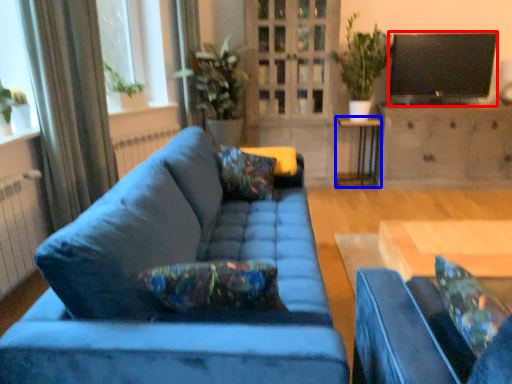
Question: Which of the following is the farthest to the observer, television (highlighted by a red box) or side table (highlighted by a blue box)?

Choices:
 (A) television
 (B) side table

Answer: (B)